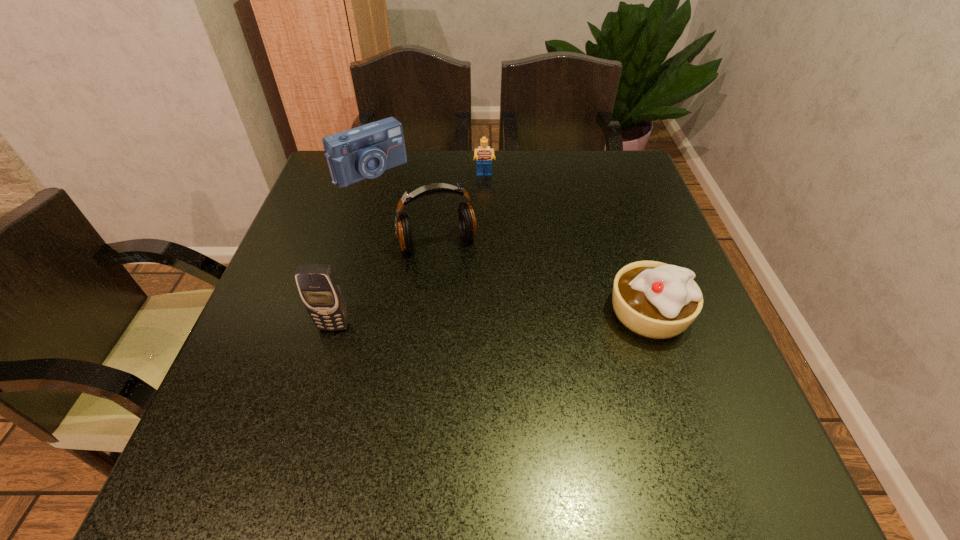
Where is `object that is at the right edge`? This screenshot has width=960, height=540. object that is at the right edge is located at coordinates (653, 299).

You are a GUI agent. You are given a task and a screenshot of the screen. Output one action in this format:
    pyautogui.click(x=<x>, y=<y>)
    Task: Click on the object that is at the far left corner
    Image resolution: width=960 pixels, height=540 pixels.
    Given the screenshot: What is the action you would take?
    pyautogui.click(x=366, y=151)

At what (x,y) coordinates should I click in order to perform the action: click on free spot at the far edge of the desktop. Please return your answer as a coordinate pair (x, y). The height and width of the screenshot is (540, 960). Looking at the image, I should click on (505, 192).

The image size is (960, 540). Identify the location of free spot at the near edge of the desktop. (545, 420).

Find the location of a particular element. The width and height of the screenshot is (960, 540). vacant position at the left edge of the desktop is located at coordinates (296, 374).

In the image, there is a desktop. Where is `free space at the right edge`? The width and height of the screenshot is (960, 540). free space at the right edge is located at coordinates (650, 215).

The image size is (960, 540). What are the coordinates of `vacant position at the far right corner of the desktop` in the screenshot? It's located at (612, 153).

Find the location of a particular element. The width and height of the screenshot is (960, 540). free space between the camera and the Lego is located at coordinates (427, 174).

Identify the location of vacant space that's between the rightmost object and the camera. The height and width of the screenshot is (540, 960). (510, 242).

The image size is (960, 540). I want to click on empty space that is in between the rightmost object and the Lego, so click(x=566, y=245).